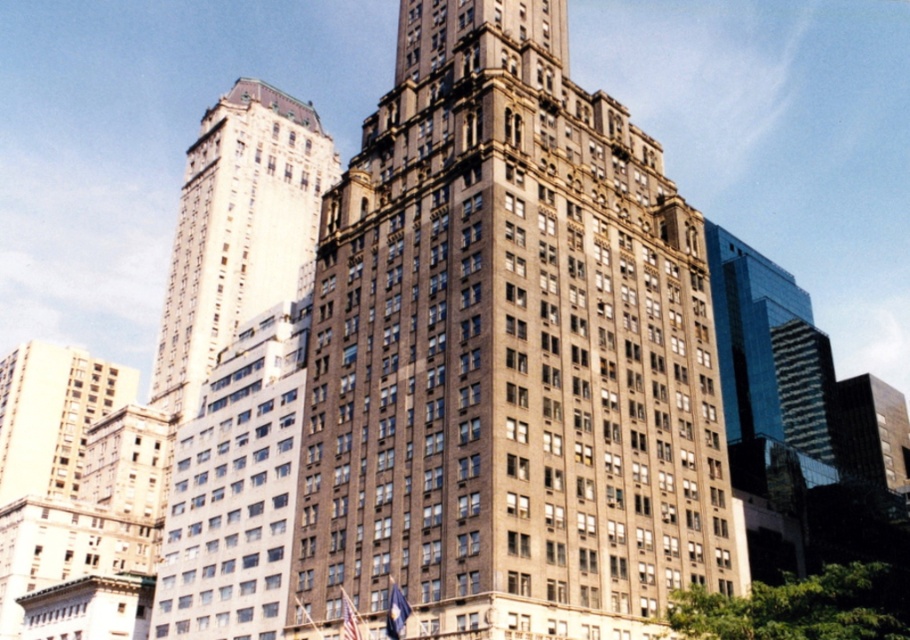
Question: Does brown stone building at center appear over white glass tower at upper left?

Choices:
 (A) no
 (B) yes

Answer: (A)

Question: From the image, what is the correct spatial relationship of brown stone building at center in relation to white glass tower at upper left?

Choices:
 (A) below
 (B) above

Answer: (A)

Question: Which object appears farthest from the camera in this image?

Choices:
 (A) brown stone building at center
 (B) white glass tower at upper left

Answer: (B)

Question: Which of the following is the closest to the observer?

Choices:
 (A) (226, 321)
 (B) (349, 416)

Answer: (B)

Question: Can you confirm if brown stone building at center is smaller than white glass tower at upper left?

Choices:
 (A) no
 (B) yes

Answer: (B)

Question: Among these objects, which one is nearest to the camera?

Choices:
 (A) brown stone building at center
 (B) white glass tower at upper left

Answer: (A)